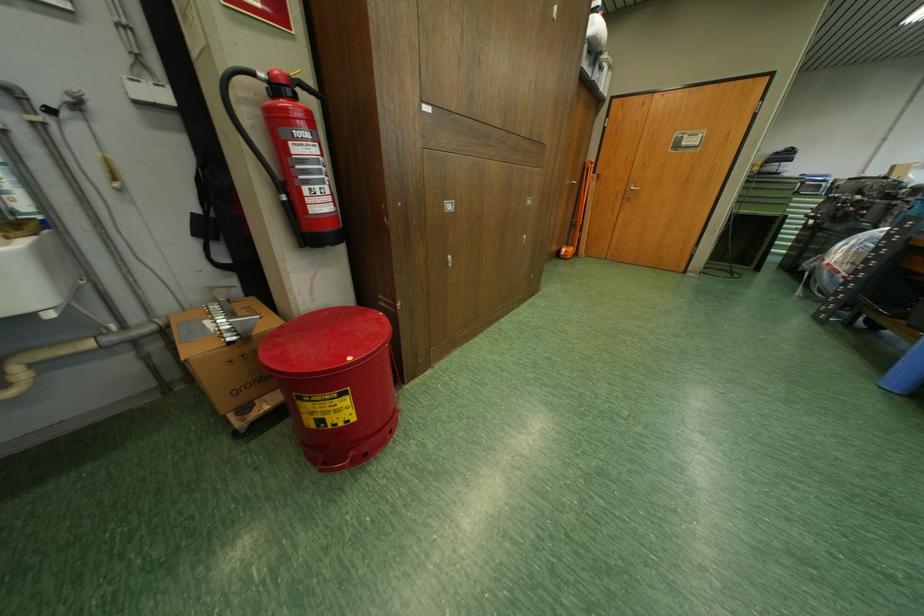
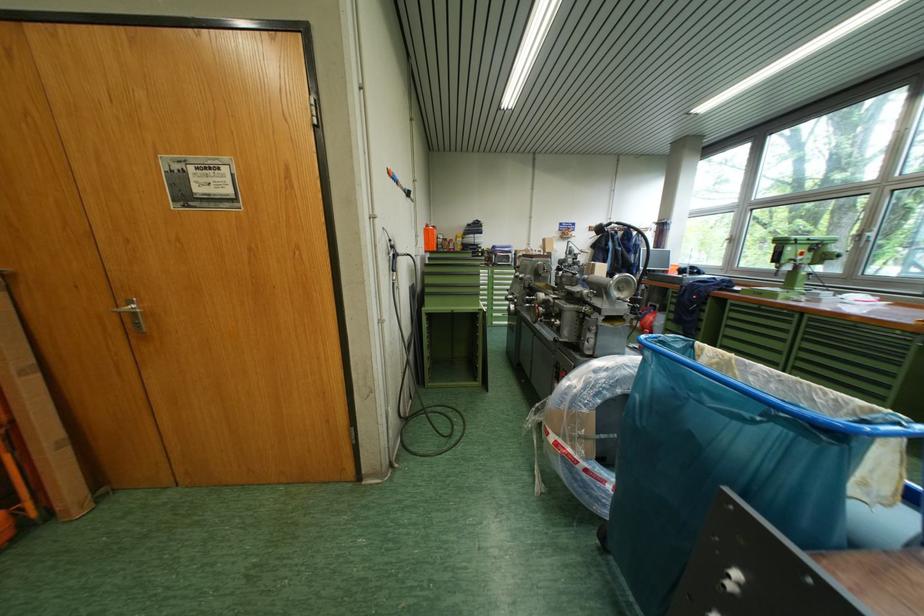
The point at [638,188] is marked in the first image. Where is the corresponding point in the second image?

(131, 305)